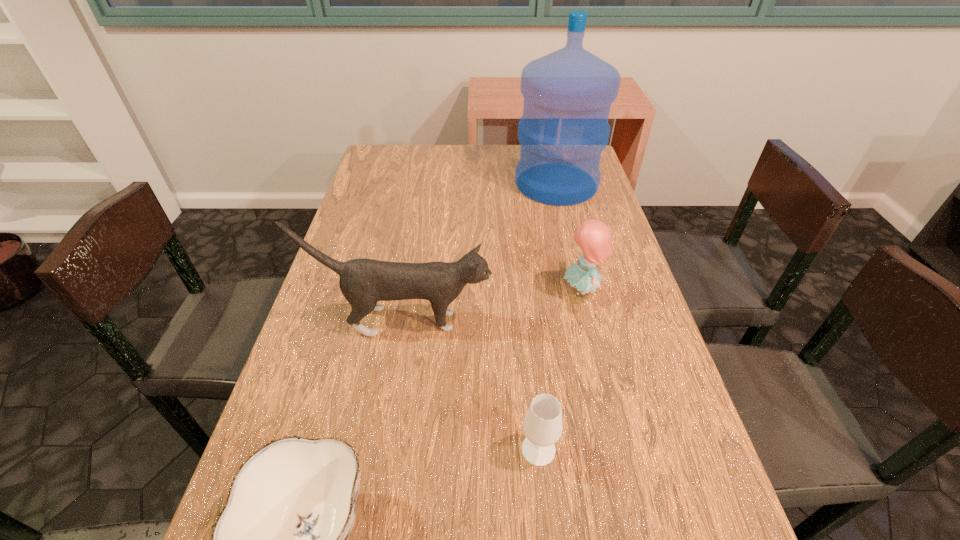
The image size is (960, 540). I want to click on vacant area that lies between the glass and the second tallest object, so click(470, 386).

The height and width of the screenshot is (540, 960). Identify the location of empty space between the glass and the water jug. (547, 316).

At what (x,y) coordinates should I click in order to perform the action: click on free area in between the water jug and the third tallest object. Please return your answer as a coordinate pair (x, y). The image size is (960, 540). Looking at the image, I should click on coord(569,237).

The height and width of the screenshot is (540, 960). Find the location of `vacant area that lies between the fourth farthest object and the water jug`. vacant area that lies between the fourth farthest object and the water jug is located at coordinates (547, 316).

Where is `object that stands as the closest to the tallest object`? Image resolution: width=960 pixels, height=540 pixels. object that stands as the closest to the tallest object is located at coordinates (593, 237).

The height and width of the screenshot is (540, 960). I want to click on the closest object to the third tallest object, so click(x=363, y=282).